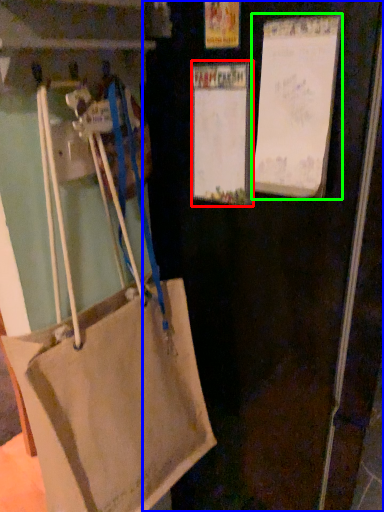
Question: Which object is the farthest from bulletin board (highlighted by a red box)? Choose among these: door (highlighted by a blue box) or bulletin board (highlighted by a green box).

Choices:
 (A) door
 (B) bulletin board

Answer: (A)